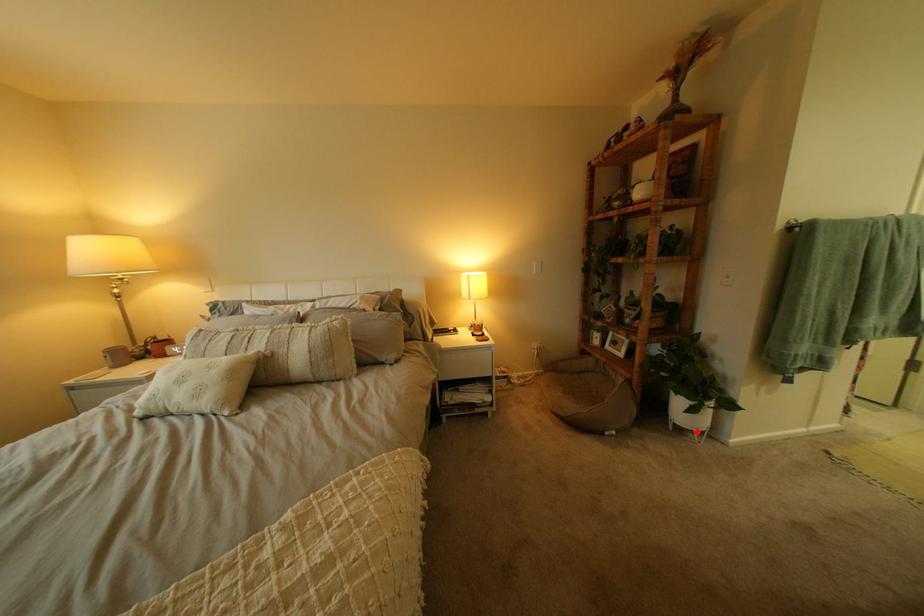
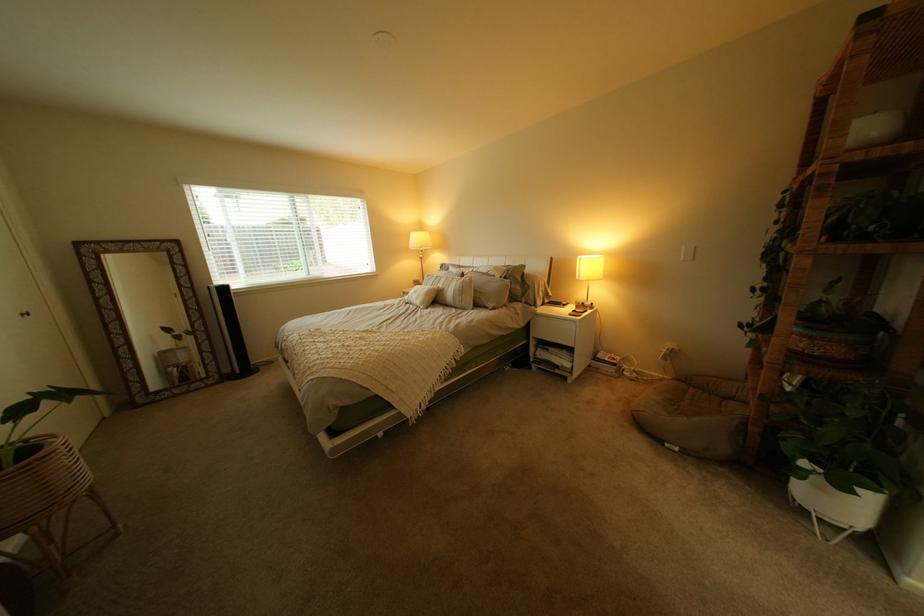
Question: A red point is marked in image1. In image2, is the corresponding 3D point closer to the camera or farther? Reply with the corresponding letter.

Choices:
 (A) The corresponding 3D point is closer.
 (B) The corresponding 3D point is farther.

Answer: (B)